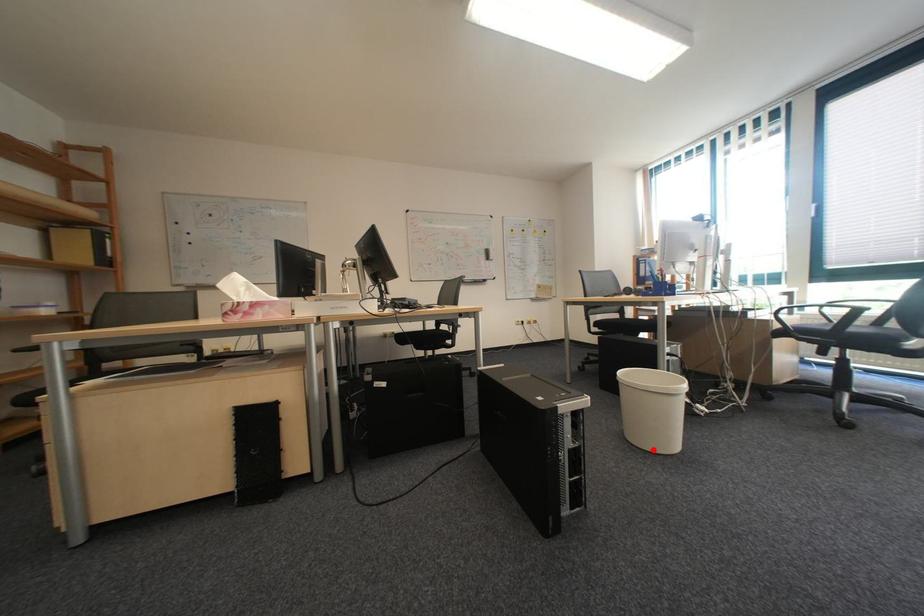
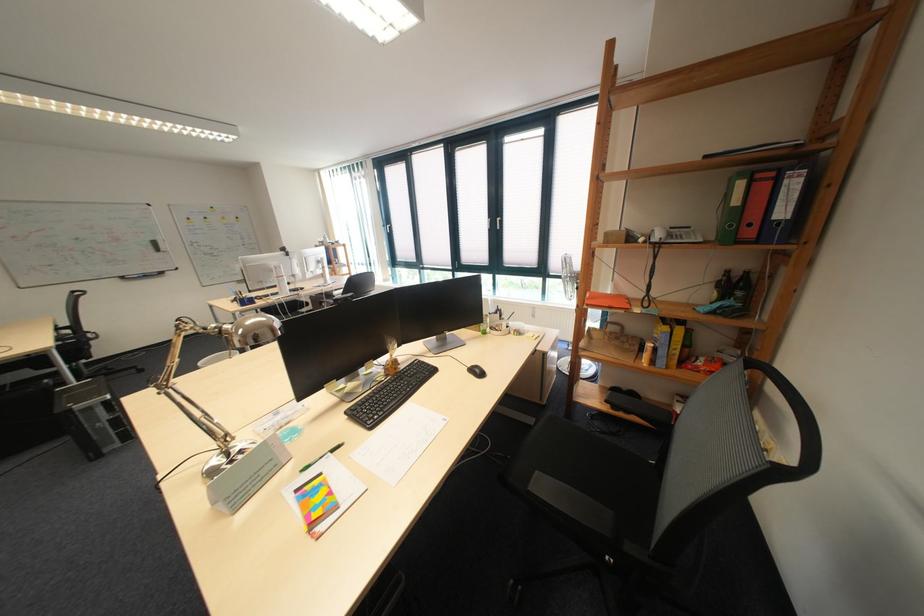
Question: I am providing you with two images of the same scene from different viewpoints. A red point is marked on the first image. At the location where the point appears in image 1, is it still visible in image 2?

Choices:
 (A) Yes
 (B) No

Answer: (B)